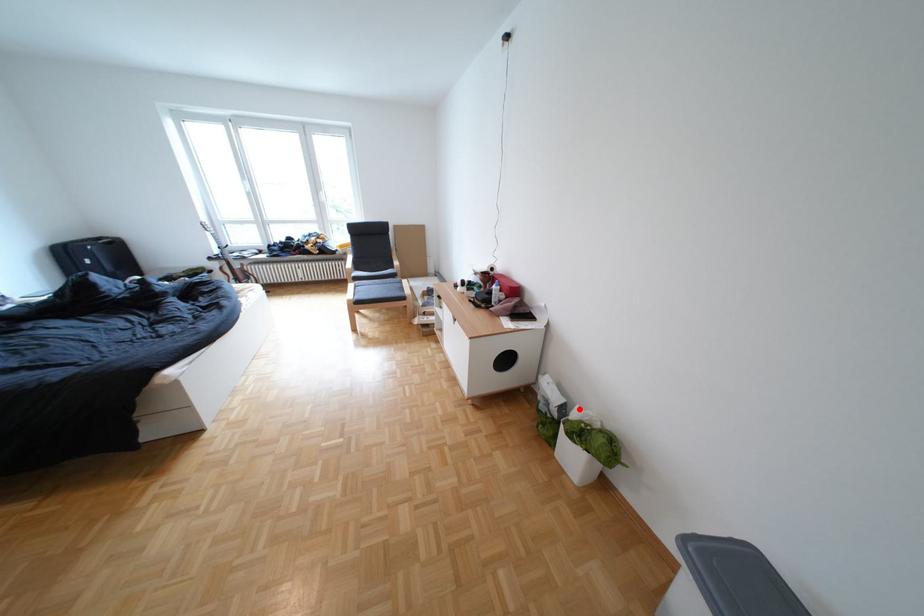
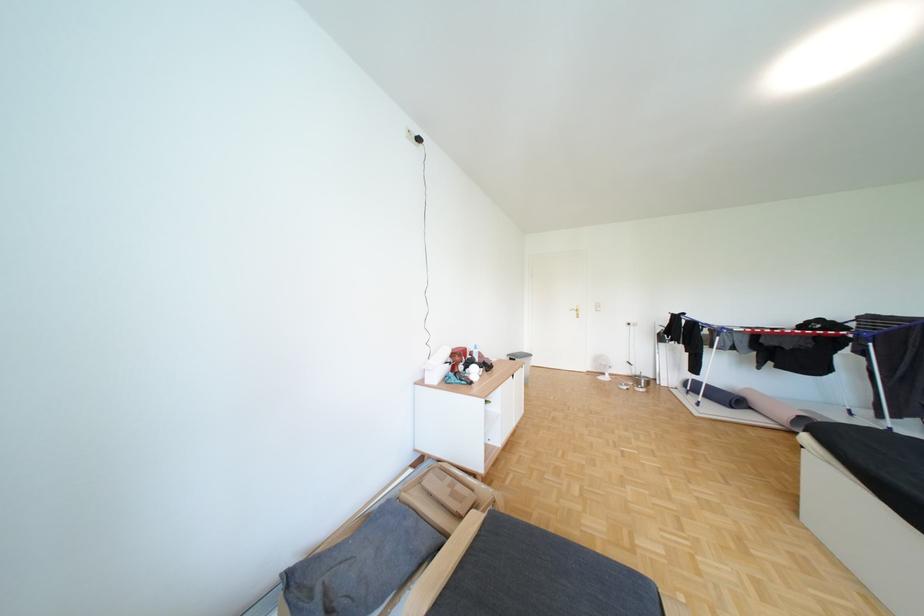
Question: I am providing you with two images of the same scene from different viewpoints. A red point is marked on the first image. Can you still see the location of the red point in image 2?

Choices:
 (A) Yes
 (B) No

Answer: (B)